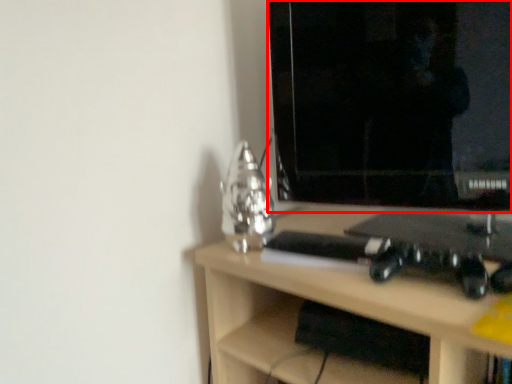
Question: Considering the relative positions of computer monitor (annotated by the red box) and desk in the image provided, where is computer monitor (annotated by the red box) located with respect to the staircase?

Choices:
 (A) left
 (B) right

Answer: (A)